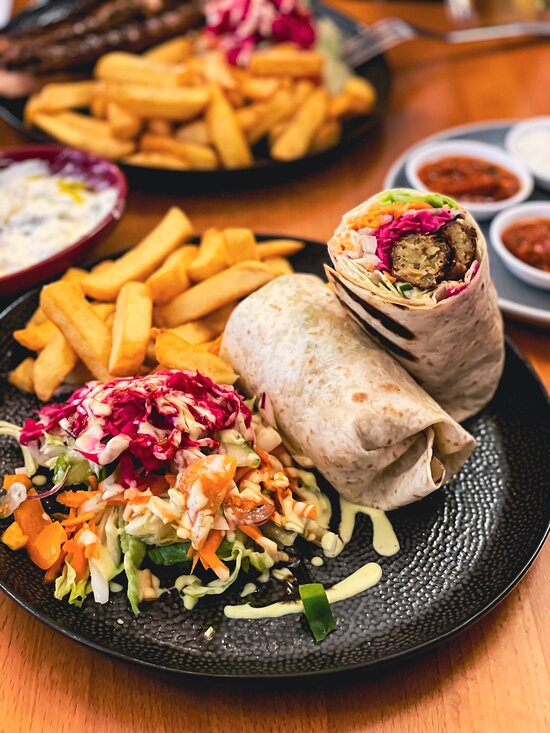
Locate an element on the screen. The height and width of the screenshot is (733, 550). blurry dish is located at coordinates (491, 187), (530, 231).